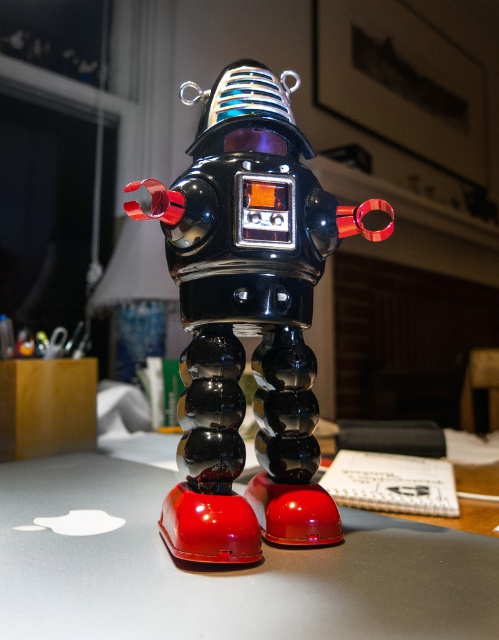
You are organizing a desk and need to place a new item between the glossy plastic robot at center and the glossy metallic table at center. Is this possible?

The glossy plastic robot at center is above the glossy metallic table at center, so there is no space between them for placing a new item.

You are organizing a desk and need to place a new item next to the glossy plastic robot at center. Considering the space it takes up, will there be enough room on the glossy metallic table at center for the new item?

The glossy plastic robot at center occupies less space than the glossy metallic table at center, so there should be enough room on the glossy metallic table at center for the new item.